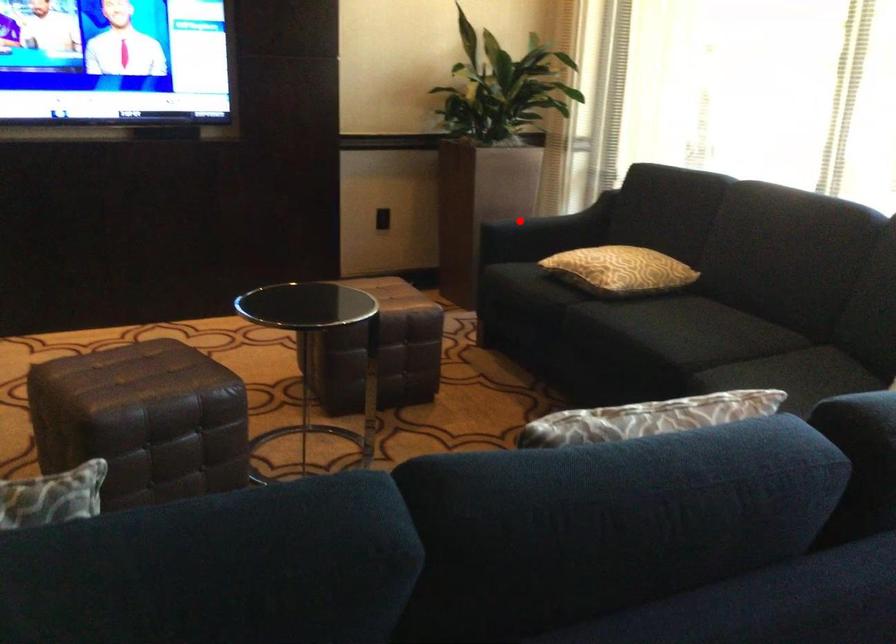
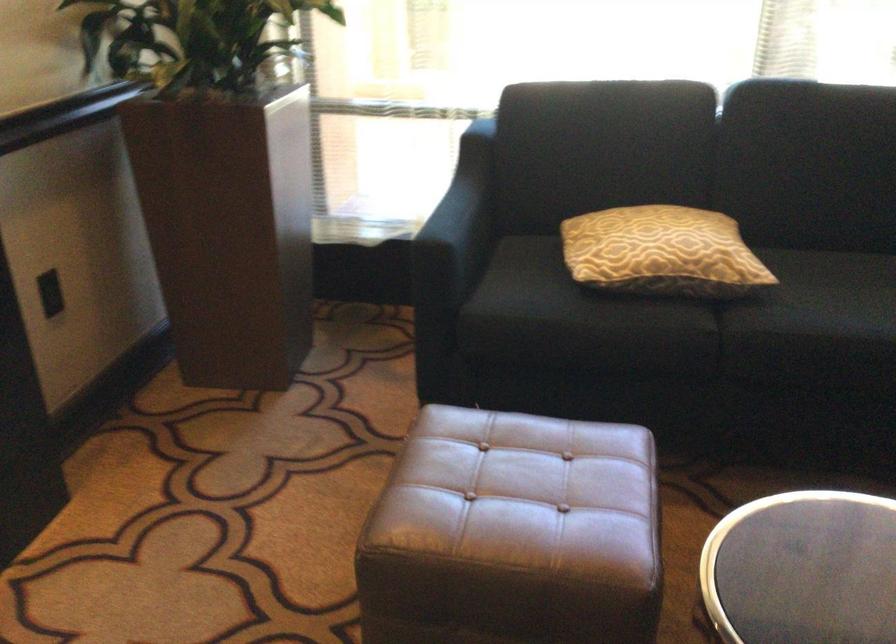
Question: I am providing you with two images of the same scene from different viewpoints. In image1, a red point is highlighted. Considering the same 3D point in image2, which of the following is correct?

Choices:
 (A) It is closer
 (B) It is farther

Answer: (A)